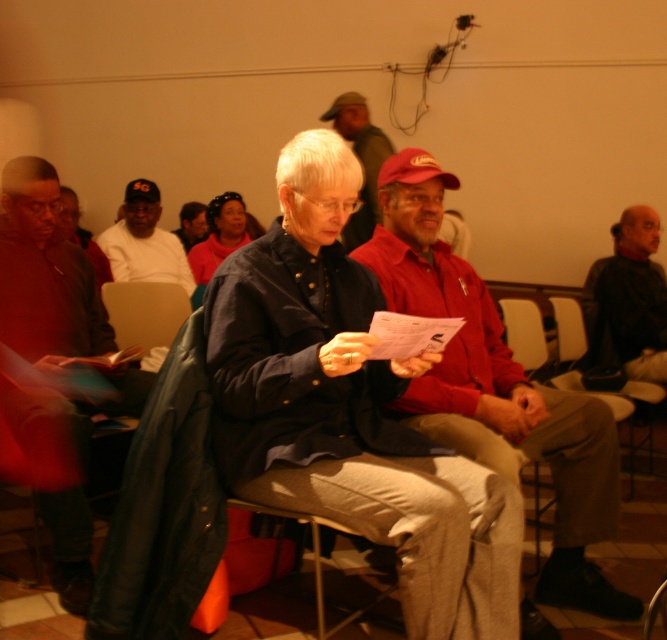
Question: Which object is closer to the camera taking this photo?

Choices:
 (A) gray fabric jacket at left
 (B) black leather jacket at right

Answer: (A)

Question: Which point appears closest to the camera in this image?

Choices:
 (A) (163, 292)
 (B) (582, 326)

Answer: (A)

Question: Observing the image, what is the correct spatial positioning of red cotton shirt at center in reference to smooth leather chair at center?

Choices:
 (A) above
 (B) below

Answer: (B)

Question: Is red cotton shirt at center above white cotton shirt at center?

Choices:
 (A) no
 (B) yes

Answer: (A)

Question: Is matte red cap at center below dark brown leather jacket at left?

Choices:
 (A) no
 (B) yes

Answer: (B)

Question: Which object is farther from the camera taking this photo?

Choices:
 (A) light brown fabric chair at center
 (B) red fabric cap at center

Answer: (B)